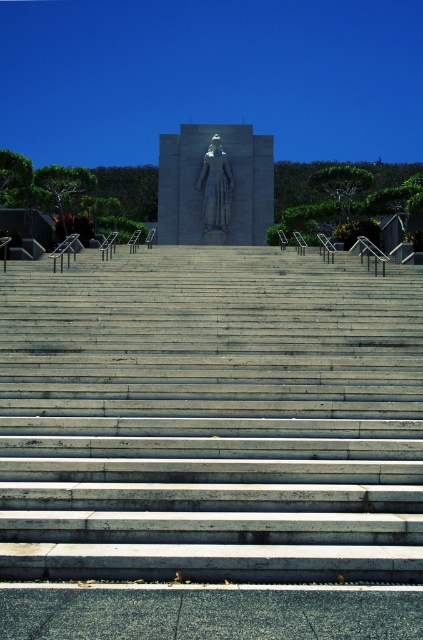
Who is higher up, gray concrete stairs at center or polished stone statue at center?

polished stone statue at center

Can you confirm if gray concrete stairs at center is bigger than polished stone statue at center?

Correct, gray concrete stairs at center is larger in size than polished stone statue at center.

Is point (208, 355) behind point (211, 154)?

No, (208, 355) is closer to viewer.

Identify the location of gray concrete stairs at center. (211, 419).

Between point (181, 166) and point (208, 193), which one is positioned in front?

Point (208, 193)

Is point (260, 225) in front of point (206, 161)?

No, (260, 225) is further to viewer.

Who is more distant from viewer, (216,241) or (208,230)?

The point (208,230) is behind.

At what (x,y) coordinates should I click in order to perform the action: click on gray stone statue at center. Please return your answer as a coordinate pair (x, y). Looking at the image, I should click on (214, 186).

Does gray concrete stairs at center have a smaller size compared to gray stone statue at center?

Actually, gray concrete stairs at center might be larger than gray stone statue at center.

Does point (326, 340) come closer to viewer compared to point (159, 189)?

Yes, point (326, 340) is in front of point (159, 189).

Who is more distant from viewer, (390, 472) or (197, 129)?

The point (197, 129) is more distant.

The width and height of the screenshot is (423, 640). I want to click on gray concrete stairs at center, so click(211, 419).